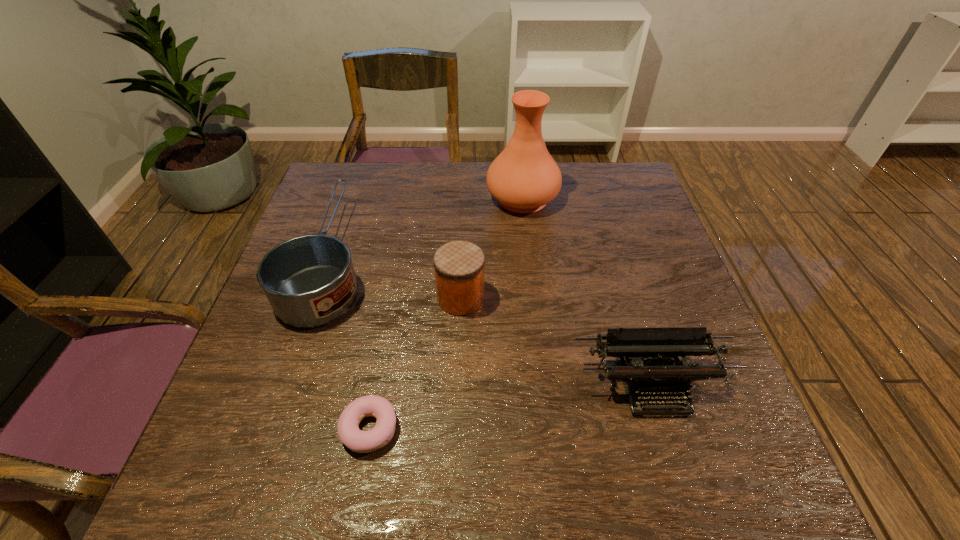
In the image, there is a desktop. Identify the location of free space at the near edge. (331, 483).

In the image, there is a desktop. Where is `vacant space at the left edge`? The height and width of the screenshot is (540, 960). vacant space at the left edge is located at coordinates (349, 214).

I want to click on vacant space at the right edge of the desktop, so click(613, 263).

Identify the location of free space at the far left corner of the desktop. The height and width of the screenshot is (540, 960). (331, 170).

The width and height of the screenshot is (960, 540). Identify the location of vacant space at the far right corner of the desktop. (623, 166).

At what (x,y) coordinates should I click in order to perform the action: click on free space between the typewriter and the tallest object. Please return your answer as a coordinate pair (x, y). This screenshot has width=960, height=540. Looking at the image, I should click on (587, 292).

Locate an element on the screen. vacant area between the doughnut and the typewriter is located at coordinates (511, 407).

Image resolution: width=960 pixels, height=540 pixels. I want to click on vacant space in between the vase and the leftmost object, so click(x=426, y=228).

Locate an element on the screen. The height and width of the screenshot is (540, 960). free point between the third object from left to right and the doughnut is located at coordinates (416, 363).

The image size is (960, 540). I want to click on vacant space in between the jar and the shortest object, so click(416, 363).